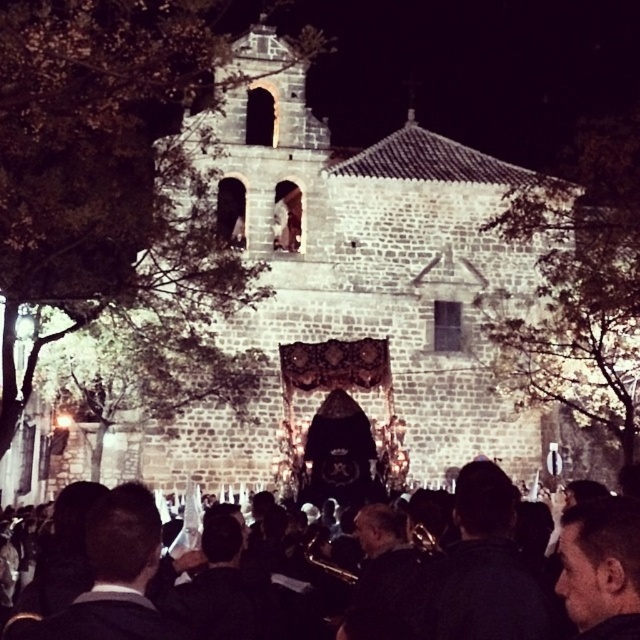
You are attending a nighttime event at the stone church at center and notice the black fabric crowd at lower center. From your perspective, which object is located to the left of the other?

The stone church at center is positioned on the left side of black fabric crowd at lower center, so the stone church at center is to the left of the black fabric crowd at lower center.

You are a photographer trying to capture the stone church at center and the black fabric crowd at lower center in a single frame. Based on their sizes, which object should you focus on to ensure both are visible without cropping?

The stone church at center is wider than the black fabric crowd at lower center. To ensure both are visible without cropping, focus on the stone church at center as it occupies more space in the frame.